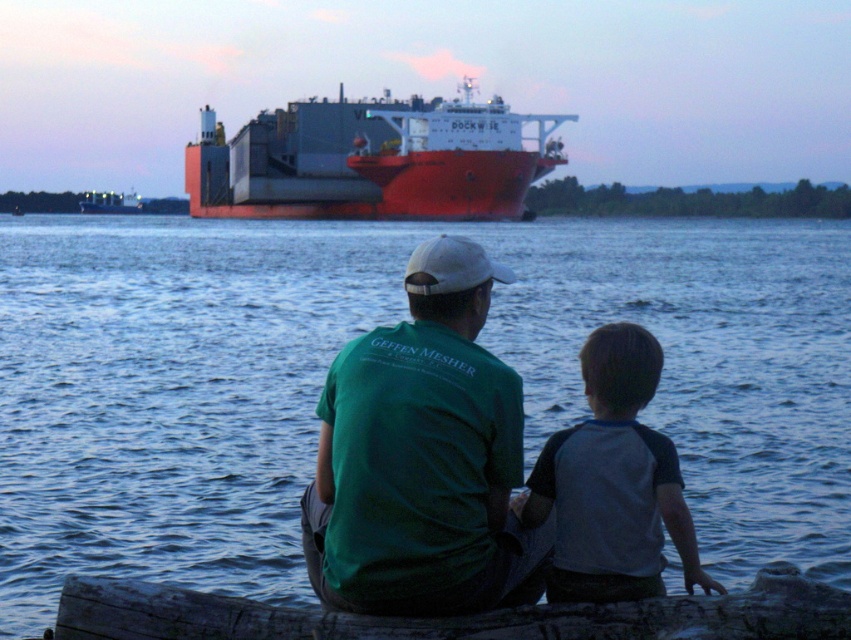
Question: Which object is positioned farthest from the metallic gray container ship at upper center?

Choices:
 (A) gray raglan shirt at lower right
 (B) green cotton shirt at center

Answer: (A)

Question: Can you confirm if green cotton shirt at center is positioned above dark brown wood log at lower center?

Choices:
 (A) yes
 (B) no

Answer: (A)

Question: Which is nearer to the blue water at center?

Choices:
 (A) green cotton shirt at center
 (B) dark brown wood log at lower center
 (C) gray raglan shirt at lower right
 (D) metallic gray container ship at upper center

Answer: (A)

Question: Which is nearer to the red matte cargo ship at center?

Choices:
 (A) gray raglan shirt at lower right
 (B) green cotton shirt at center

Answer: (B)

Question: Does green cotton shirt at center have a smaller size compared to red matte cargo ship at center?

Choices:
 (A) yes
 (B) no

Answer: (A)

Question: Does green cotton shirt at center appear over dark brown wood log at lower center?

Choices:
 (A) yes
 (B) no

Answer: (A)